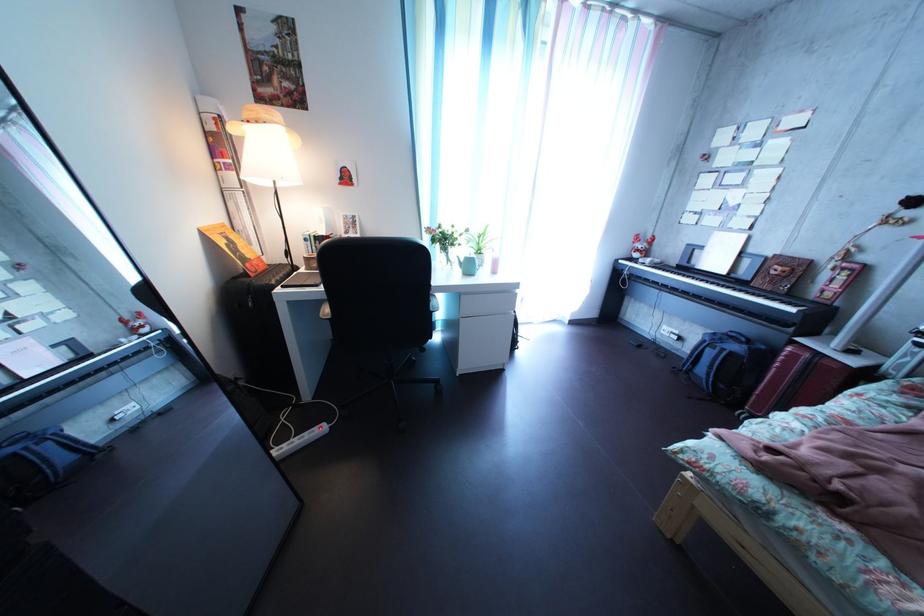
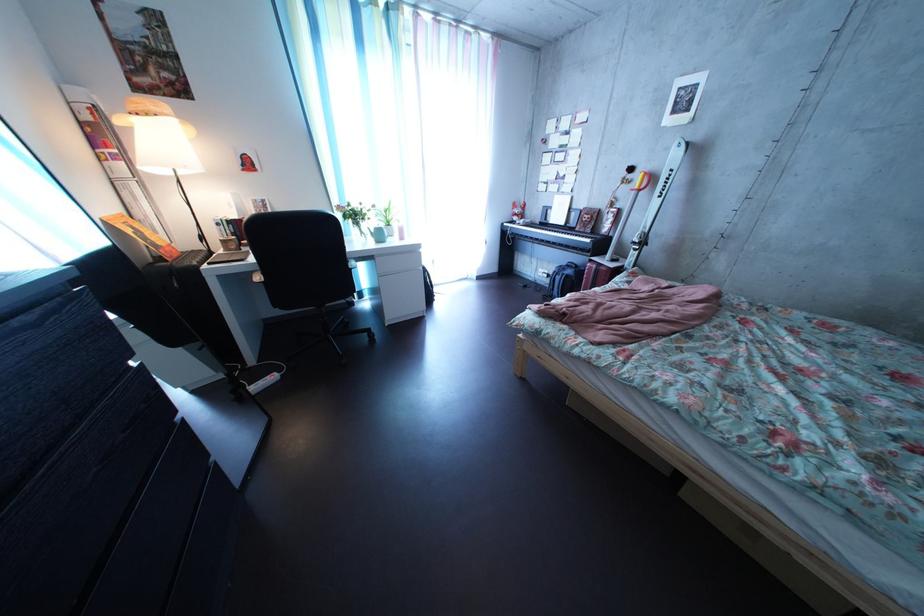
In the second image, find the point that corresponds to point (673, 322) in the first image.

(550, 269)